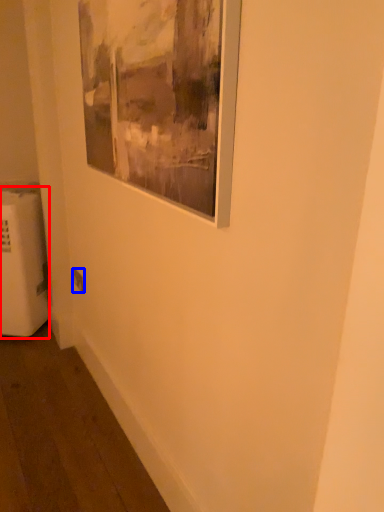
Question: Which point is further to the camera, radiator (highlighted by a red box) or electric outlet (highlighted by a blue box)?

Choices:
 (A) radiator
 (B) electric outlet

Answer: (B)